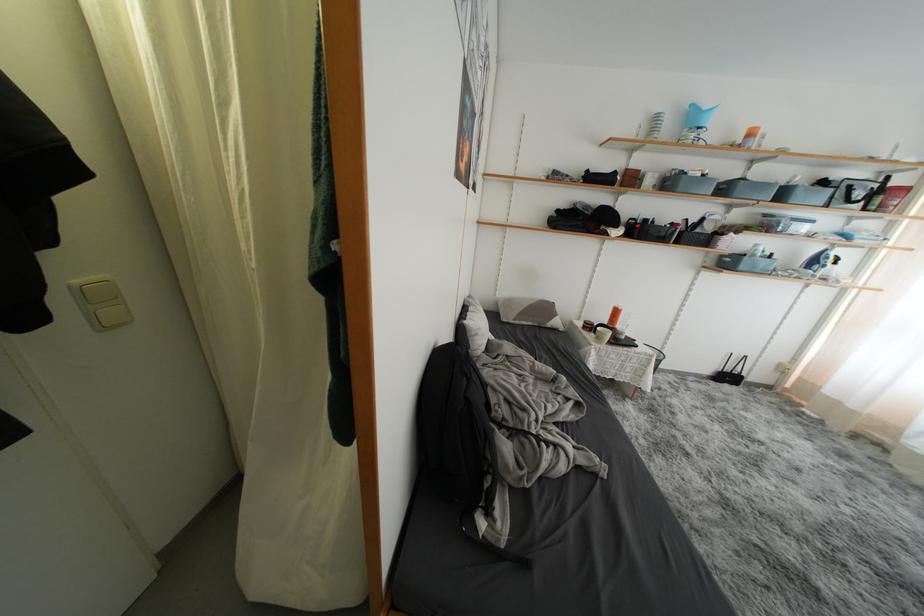
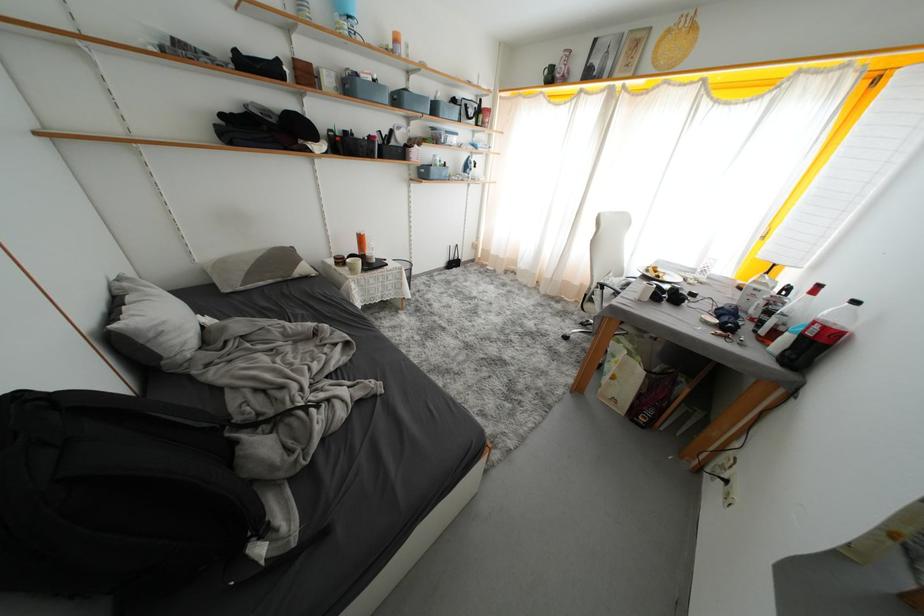
Find the pixel in the second image that matches pixel 735 267 in the first image.

(431, 177)